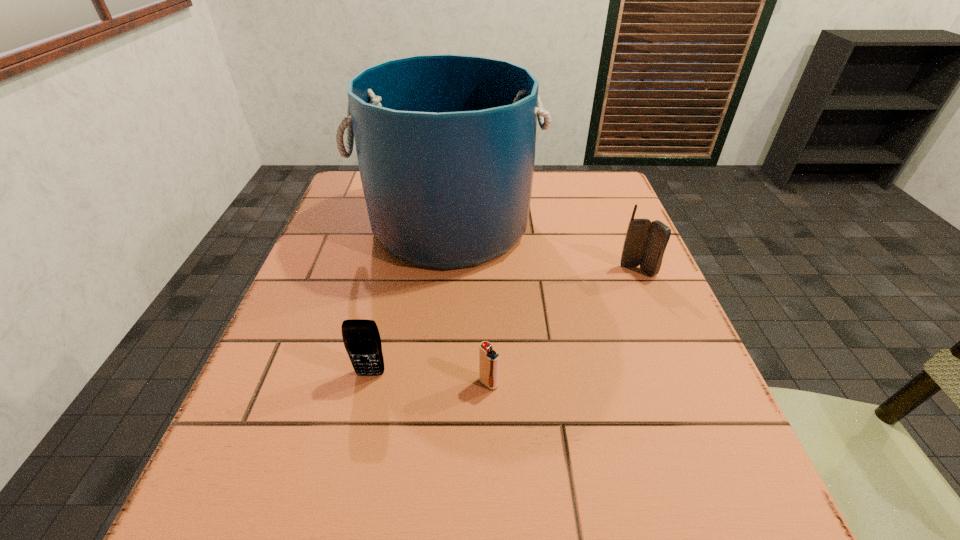
Locate an element on the screen. the tallest object is located at coordinates (445, 143).

The image size is (960, 540). What are the coordinates of `the right cellular telephone` in the screenshot? It's located at (645, 242).

Where is `the rightmost object`? The image size is (960, 540). the rightmost object is located at coordinates (645, 242).

Locate an element on the screen. This screenshot has height=540, width=960. the third tallest object is located at coordinates (361, 337).

Locate an element on the screen. The image size is (960, 540). the left cellular telephone is located at coordinates (361, 337).

You are a GUI agent. You are given a task and a screenshot of the screen. Output one action in this format:
    pyautogui.click(x=<x>, y=<y>)
    Task: Click on the shortest object
    
    Given the screenshot: What is the action you would take?
    pyautogui.click(x=488, y=359)

Where is `blank space located on the front of the bucket`? blank space located on the front of the bucket is located at coordinates (435, 387).

Find the location of a particular element. blank space located 0.170m on the keyboard of the taller cellular telephone is located at coordinates (666, 339).

At what (x,y) coordinates should I click in order to perform the action: click on free region located on the screen of the shorter cellular telephone. Please return your answer as a coordinate pair (x, y). This screenshot has height=540, width=960. Looking at the image, I should click on (347, 480).

Locate an element on the screen. vacant point located 0.240m on the left of the igniter is located at coordinates (337, 383).